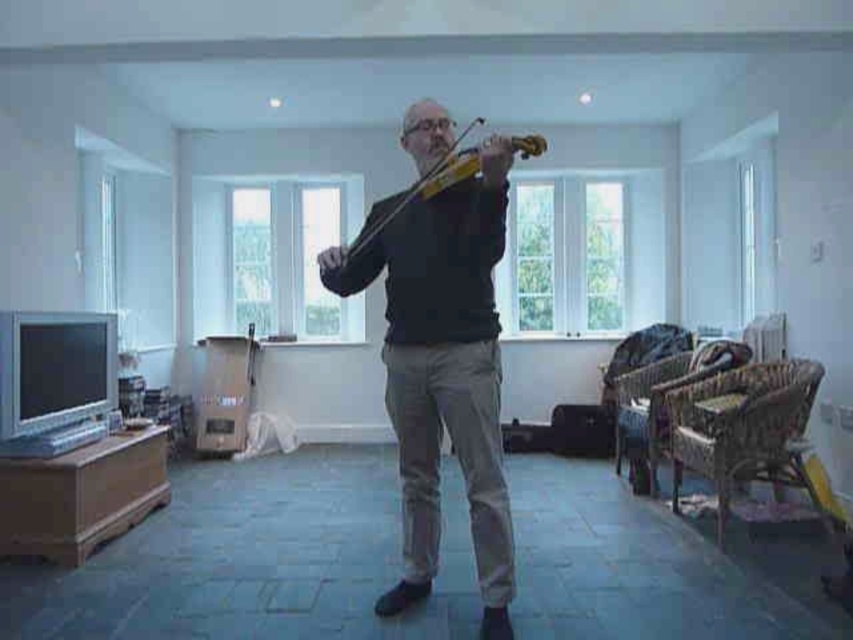
Can you confirm if dark gray sweater at center is bigger than wooden violin at center?

Correct, dark gray sweater at center is larger in size than wooden violin at center.

Is dark gray sweater at center to the left of wooden violin at center from the viewer's perspective?

Yes, dark gray sweater at center is to the left of wooden violin at center.

Find the location of a particular element. This screenshot has height=640, width=853. dark gray sweater at center is located at coordinates (444, 372).